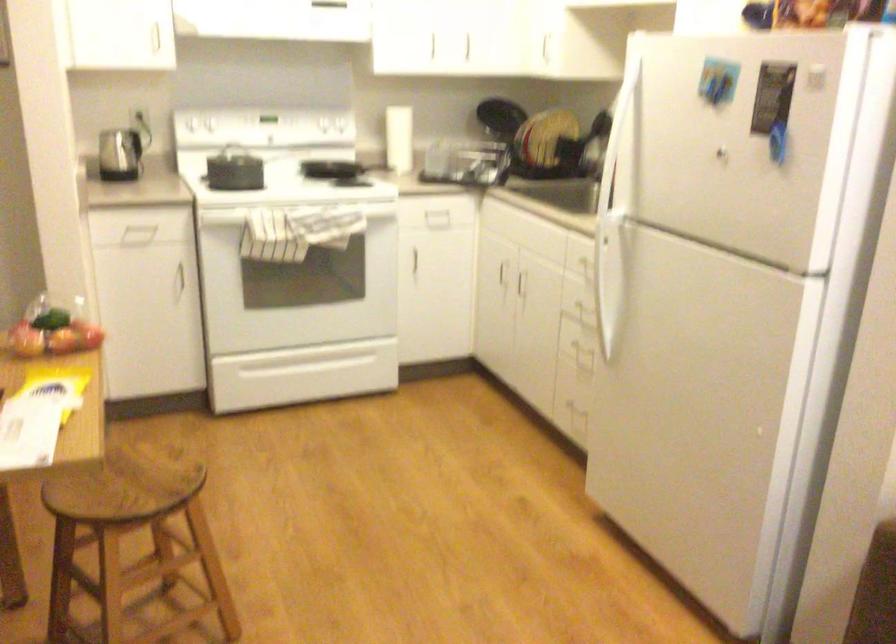
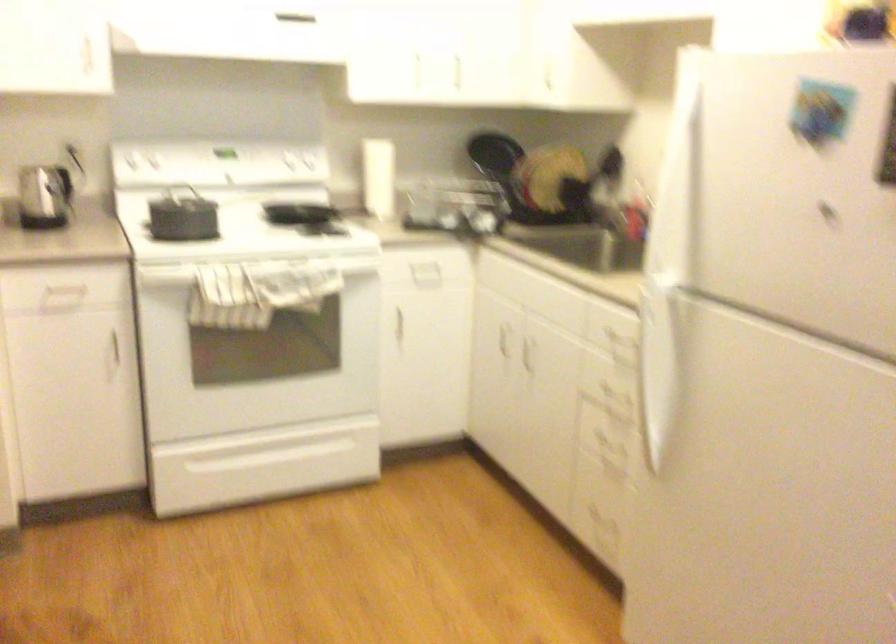
Where in the second image is the point corresponding to the point at 437,272 from the first image?

(425, 342)